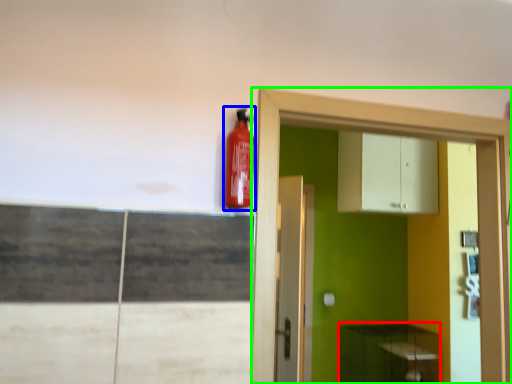
Question: Which object is positioned closest to cabinetry (highlighted by a red box)? Select from extinguisher (highlighted by a blue box) and dresser (highlighted by a green box).

Choices:
 (A) extinguisher
 (B) dresser

Answer: (B)